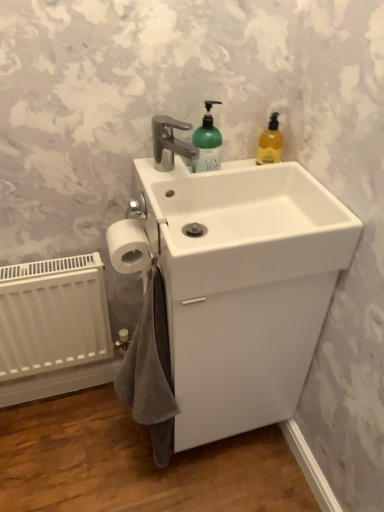
In order to click on gray cotton bath towel at lower left in this screenshot , I will do `click(151, 372)`.

What are the coordinates of `translucent amber liquid soap at upper right` in the screenshot? It's located at (270, 143).

The width and height of the screenshot is (384, 512). Describe the element at coordinates (53, 315) in the screenshot. I see `white matte radiator at lower left` at that location.

Find the location of `white glossy sink at center`. white glossy sink at center is located at coordinates (247, 225).

Identify the location of gray cotton bath towel at lower left. The width and height of the screenshot is (384, 512). (151, 372).

How far apart are translucent amber liquid soap at upper right and gray cotton bath towel at lower left?

23.63 inches.

Considering the relative sizes of translucent amber liquid soap at upper right and gray cotton bath towel at lower left in the image provided, is translucent amber liquid soap at upper right taller than gray cotton bath towel at lower left?

No, translucent amber liquid soap at upper right is not taller than gray cotton bath towel at lower left.

From the picture: Which of these two, translucent amber liquid soap at upper right or gray cotton bath towel at lower left, is thinner?

With smaller width is translucent amber liquid soap at upper right.

Consider the image. Can you confirm if translucent amber liquid soap at upper right is smaller than gray cotton bath towel at lower left?

Indeed, translucent amber liquid soap at upper right has a smaller size compared to gray cotton bath towel at lower left.

Which object is wider, white glossy sink at center or gray cotton bath towel at lower left?

With larger width is white glossy sink at center.

Is point (326, 298) closer to camera compared to point (154, 454)?

Yes.

Considering the relative sizes of white glossy sink at center and gray cotton bath towel at lower left in the image provided, is white glossy sink at center shorter than gray cotton bath towel at lower left?

Correct, white glossy sink at center is not as tall as gray cotton bath towel at lower left.

Is the depth of translucent amber liquid soap at upper right less than that of white matte radiator at lower left?

Yes, translucent amber liquid soap at upper right is closer to the viewer.

Considering the relative sizes of translucent amber liquid soap at upper right and white matte radiator at lower left in the image provided, is translucent amber liquid soap at upper right bigger than white matte radiator at lower left?

Actually, translucent amber liquid soap at upper right might be smaller than white matte radiator at lower left.

Between translucent amber liquid soap at upper right and white matte radiator at lower left, which one has more height?

white matte radiator at lower left is taller.

Is white matte radiator at lower left oriented away from white glossy sink at center?

No, white matte radiator at lower left's orientation is not away from white glossy sink at center.

Can you confirm if white matte radiator at lower left is positioned to the left of white glossy sink at center?

Yes, white matte radiator at lower left is to the left of white glossy sink at center.

Considering the relative positions of white matte radiator at lower left and white glossy sink at center in the image provided, is white matte radiator at lower left in front of white glossy sink at center?

No, the depth of white matte radiator at lower left is greater than that of white glossy sink at center.

Between white matte radiator at lower left and translucent amber liquid soap at upper right, which one has smaller width?

Thinner between the two is translucent amber liquid soap at upper right.

Is there a large distance between white matte radiator at lower left and translucent amber liquid soap at upper right?

No.

There is a white matte radiator at lower left. Identify the location of cleaning product above it (from a real-world perspective). This screenshot has height=512, width=384. (270, 143).

From a real-world perspective, which is physically above, white matte radiator at lower left or translucent amber liquid soap at upper right?

translucent amber liquid soap at upper right is physically above.

Is white matte radiator at lower left facing away from white matte toilet paper at lower left?

No, white matte radiator at lower left's orientation is not away from white matte toilet paper at lower left.

Is the position of white matte radiator at lower left more distant than that of white matte toilet paper at lower left?

Yes, it is.

I want to click on toilet paper in front of the white matte radiator at lower left, so click(128, 246).

Locate an element on the screen. counter top on the right of white matte radiator at lower left is located at coordinates (247, 225).

In the scene shown: In terms of width, does white matte radiator at lower left look wider or thinner when compared to white glossy sink at center?

white matte radiator at lower left is thinner than white glossy sink at center.

In terms of size, does white matte radiator at lower left appear bigger or smaller than white glossy sink at center?

Clearly, white matte radiator at lower left is smaller in size than white glossy sink at center.

Is white matte radiator at lower left to the right of white glossy sink at center from the viewer's perspective?

No, white matte radiator at lower left is not to the right of white glossy sink at center.

Identify the location of cleaning product on the right of gray cotton bath towel at lower left. The image size is (384, 512). (270, 143).

In order to click on sink above the gray cotton bath towel at lower left (from the image's perspective) in this screenshot , I will do `click(240, 282)`.

Based on their spatial positions, is white matte radiator at lower left or translucent amber liquid soap at upper right closer to white glossy sink at center?

translucent amber liquid soap at upper right is positioned closer to the anchor white glossy sink at center.

Which object lies further to the anchor point white glossy sink at center, white glossy sink at center or white matte radiator at lower left?

white matte radiator at lower left lies further to white glossy sink at center than the other object.

Which object lies further to the anchor point white glossy sink at center, white matte radiator at lower left or white matte toilet paper at lower left?

Based on the image, white matte radiator at lower left appears to be further to white glossy sink at center.

Based on their spatial positions, is translucent amber liquid soap at upper right or white matte toilet paper at lower left closer to white matte radiator at lower left?

white matte toilet paper at lower left is positioned closer to the anchor white matte radiator at lower left.

Considering their positions, is white glossy sink at center positioned further to white matte radiator at lower left than translucent amber liquid soap at upper right?

Among the two, translucent amber liquid soap at upper right is located further to white matte radiator at lower left.

From the picture: Looking at the image, which one is located closer to gray cotton bath towel at lower left, translucent amber liquid soap at upper right or white glossy sink at center?

Based on the image, white glossy sink at center appears to be nearer to gray cotton bath towel at lower left.

From the image, which object appears to be farther from white matte toilet paper at lower left, white glossy sink at center or white matte radiator at lower left?

white matte radiator at lower left is further to white matte toilet paper at lower left.

Which object lies nearer to the anchor point translucent amber liquid soap at upper right, white glossy sink at center or white glossy sink at center?

The object closer to translucent amber liquid soap at upper right is white glossy sink at center.

Where is `radiator between white matte toilet paper at lower left and gray cotton bath towel at lower left in the vertical direction`? radiator between white matte toilet paper at lower left and gray cotton bath towel at lower left in the vertical direction is located at coordinates (53, 315).

I want to click on toilet paper between white glossy sink at center and white glossy sink at center in the vertical direction, so click(128, 246).

This screenshot has width=384, height=512. I want to click on toilet paper located between white matte radiator at lower left and white glossy sink at center in the left-right direction, so click(128, 246).

At what (x,y) coordinates should I click in order to perform the action: click on sink between white matte radiator at lower left and white glossy sink at center from left to right. Please return your answer as a coordinate pair (x, y). The height and width of the screenshot is (512, 384). Looking at the image, I should click on (240, 282).